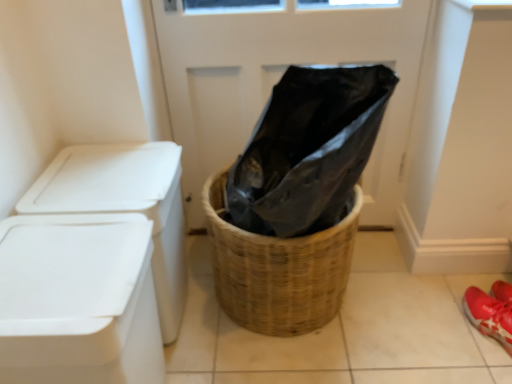
The height and width of the screenshot is (384, 512). Identify the location of free space above white plastic container at left (from a real-world perspective). (67, 260).